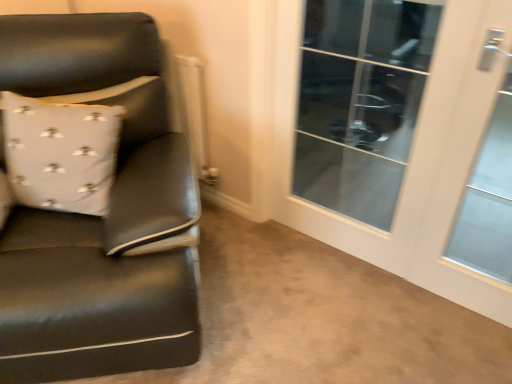
What do you see at coordinates (471, 163) in the screenshot?
I see `white glossy door at right, which is counted as the first screen door, starting from the right` at bounding box center [471, 163].

The image size is (512, 384). Describe the element at coordinates (100, 217) in the screenshot. I see `matte black leather chair at left` at that location.

This screenshot has width=512, height=384. Find the location of `transparent glass door at upper right`. transparent glass door at upper right is located at coordinates (360, 102).

Identify the location of transparent glass door at right, which is counted as the second screen door, starting from the right. (409, 160).

From the image's perspective, between white textured pillow at left and white glossy door at right, which is counted as the first screen door, starting from the right, who is located below?

white glossy door at right, which is counted as the first screen door, starting from the right, appears lower in the image.

Between white textured pillow at left and white glossy door at right, arranged as the second screen door when viewed from the left, which one has smaller width?

white glossy door at right, arranged as the second screen door when viewed from the left, is thinner.

Between point (98, 148) and point (479, 19), which one is positioned in front?

The point (479, 19) is in front.

Could you measure the distance between white textured pillow at left and white glossy door at right, arranged as the second screen door when viewed from the left?

They are 5.69 feet apart.

Is transparent glass door at upper right turned away from white glossy door at right, which is counted as the first screen door, starting from the right?

transparent glass door at upper right does not have its back to white glossy door at right, which is counted as the first screen door, starting from the right.

Do you think transparent glass door at upper right is within white glossy door at right, arranged as the second screen door when viewed from the left, or outside of it?

transparent glass door at upper right cannot be found inside white glossy door at right, arranged as the second screen door when viewed from the left.

Is transparent glass door at upper right to the right of white glossy door at right, arranged as the second screen door when viewed from the left, from the viewer's perspective?

Incorrect, transparent glass door at upper right is not on the right side of white glossy door at right, arranged as the second screen door when viewed from the left.

Which is behind, point (328, 60) or point (469, 266)?

The point (328, 60) is farther.

Is point (40, 322) farther from viewer compared to point (75, 188)?

That is False.

Which is in front, matte black leather chair at left or white textured pillow at left?

matte black leather chair at left is more forward.

In terms of height, does matte black leather chair at left look taller or shorter compared to white textured pillow at left?

Clearly, matte black leather chair at left is taller compared to white textured pillow at left.

Is there a large distance between matte black leather chair at left and white textured pillow at left?

matte black leather chair at left is actually quite close to white textured pillow at left.

Which object is further away from the camera, white glossy door at right, which is counted as the first screen door, starting from the right, or transparent glass door at upper right?

transparent glass door at upper right is further from the camera.

Could you tell me if white glossy door at right, arranged as the second screen door when viewed from the left, is facing transparent glass door at upper right?

No, white glossy door at right, arranged as the second screen door when viewed from the left, is not facing towards transparent glass door at upper right.

From the image's perspective, is white glossy door at right, arranged as the second screen door when viewed from the left, above or below transparent glass door at upper right?

Clearly, from the image's perspective, white glossy door at right, arranged as the second screen door when viewed from the left, is below transparent glass door at upper right.

Which of these two, white glossy door at right, arranged as the second screen door when viewed from the left, or transparent glass door at upper right, is thinner?

With smaller width is transparent glass door at upper right.

Is transparent glass door at upper right not within white textured pillow at left?

Absolutely, transparent glass door at upper right is external to white textured pillow at left.

How distant is transparent glass door at upper right from white textured pillow at left?

transparent glass door at upper right and white textured pillow at left are 5.01 feet apart from each other.

This screenshot has height=384, width=512. I want to click on glass door on the right side of white textured pillow at left, so click(x=360, y=102).

From the image's perspective, which one is positioned lower, transparent glass door at upper right or white textured pillow at left?

From the image's view, white textured pillow at left is below.

From the image's perspective, starting from the matte black leather chair at left, which screen door is the 1st one above? Please provide its 2D coordinates.

[(471, 163)]

In terms of height, does matte black leather chair at left look taller or shorter compared to white glossy door at right, which is counted as the first screen door, starting from the right?

Clearly, matte black leather chair at left is shorter compared to white glossy door at right, which is counted as the first screen door, starting from the right.

Which object is further away from the camera taking this photo, matte black leather chair at left or white glossy door at right, which is counted as the first screen door, starting from the right?

Positioned behind is white glossy door at right, which is counted as the first screen door, starting from the right.

Is white glossy door at right, arranged as the second screen door when viewed from the left, inside matte black leather chair at left?

No, matte black leather chair at left does not contain white glossy door at right, arranged as the second screen door when viewed from the left.

From the image's perspective, is transparent glass door at right, which is counted as the second screen door, starting from the right, located above matte black leather chair at left?

Correct, transparent glass door at right, which is counted as the second screen door, starting from the right, appears higher than matte black leather chair at left in the image.

From the picture: From a real-world perspective, between transparent glass door at right, which is counted as the second screen door, starting from the right, and matte black leather chair at left, who is vertically lower?

matte black leather chair at left.

Does point (289, 146) come closer to viewer compared to point (118, 351)?

No.

At what (x,y) coordinates should I click in order to perform the action: click on chair located below the transparent glass door at right, which is counted as the second screen door, starting from the right (from the image's perspective). Please return your answer as a coordinate pair (x, y). This screenshot has width=512, height=384. Looking at the image, I should click on (100, 217).

Starting from the white textured pillow at left, which screen door is the 2nd one to the right? Please provide its 2D coordinates.

[(471, 163)]

From a real-world perspective, which screen door is the 1st one underneath the transparent glass door at upper right? Please provide its 2D coordinates.

[(471, 163)]

Considering their positions, is white textured pillow at left positioned closer to transparent glass door at upper right than transparent glass door at right, arranged as the 1th screen door when viewed from the left?

transparent glass door at right, arranged as the 1th screen door when viewed from the left.

Considering their positions, is white textured pillow at left positioned further to white glossy door at right, arranged as the second screen door when viewed from the left, than transparent glass door at upper right?

white textured pillow at left lies further to white glossy door at right, arranged as the second screen door when viewed from the left, than the other object.

Based on the photo, from the image, which object appears to be nearer to matte black leather chair at left, transparent glass door at upper right or white textured pillow at left?

white textured pillow at left.

Estimate the real-world distances between objects in this image. Which object is closer to white textured pillow at left, white glossy door at right, arranged as the second screen door when viewed from the left, or matte black leather chair at left?

matte black leather chair at left.

Estimate the real-world distances between objects in this image. Which object is further from transparent glass door at right, which is counted as the second screen door, starting from the right, matte black leather chair at left or transparent glass door at upper right?

transparent glass door at upper right is further to transparent glass door at right, which is counted as the second screen door, starting from the right.

Based on their spatial positions, is matte black leather chair at left or white glossy door at right, arranged as the second screen door when viewed from the left, closer to transparent glass door at right, arranged as the 1th screen door when viewed from the left?

white glossy door at right, arranged as the second screen door when viewed from the left, is closer to transparent glass door at right, arranged as the 1th screen door when viewed from the left.

In the scene shown: Based on their spatial positions, is white glossy door at right, which is counted as the first screen door, starting from the right, or white textured pillow at left closer to transparent glass door at upper right?

white glossy door at right, which is counted as the first screen door, starting from the right.

Considering their positions, is transparent glass door at upper right positioned further to white glossy door at right, which is counted as the first screen door, starting from the right, than matte black leather chair at left?

matte black leather chair at left is further to white glossy door at right, which is counted as the first screen door, starting from the right.

At what (x,y) coordinates should I click in order to perform the action: click on pillow between matte black leather chair at left and transparent glass door at upper right in the horizontal direction. Please return your answer as a coordinate pair (x, y). Looking at the image, I should click on point(61,153).

At what (x,y) coordinates should I click in order to perform the action: click on glass door between white textured pillow at left and transparent glass door at right, which is counted as the second screen door, starting from the right, from left to right. Please return your answer as a coordinate pair (x, y). The height and width of the screenshot is (384, 512). Looking at the image, I should click on (360, 102).

The image size is (512, 384). In order to click on screen door between matte black leather chair at left and white glossy door at right, which is counted as the first screen door, starting from the right, from left to right in this screenshot , I will do `click(409, 160)`.

Where is `glass door located between matte black leather chair at left and white glossy door at right, which is counted as the first screen door, starting from the right, in the left-right direction`? The width and height of the screenshot is (512, 384). glass door located between matte black leather chair at left and white glossy door at right, which is counted as the first screen door, starting from the right, in the left-right direction is located at coordinates (360, 102).